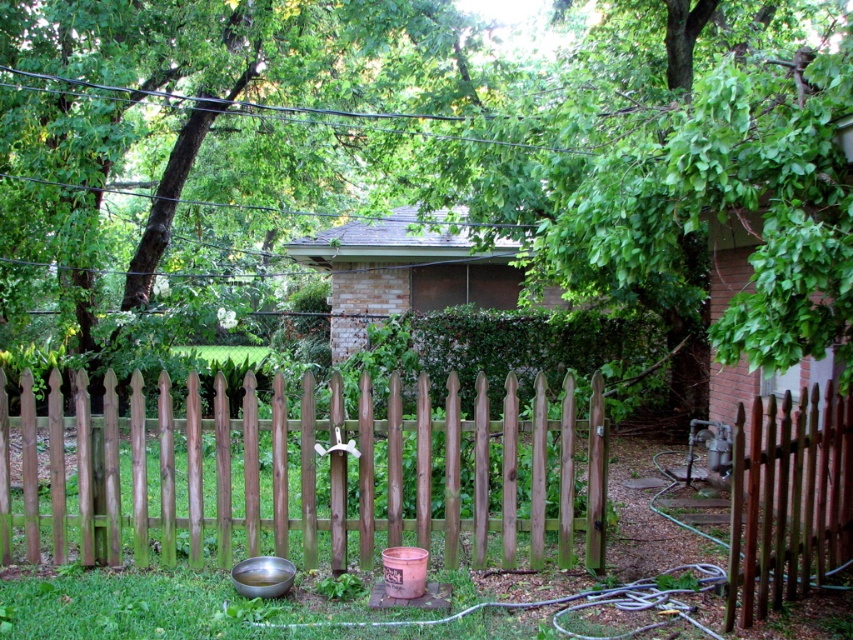
Is brown wooden fence at center above brown wooden fence at right?

No, brown wooden fence at center is not above brown wooden fence at right.

Is brown wooden fence at center smaller than brown wooden fence at right?

Actually, brown wooden fence at center might be larger than brown wooden fence at right.

Which is behind, point (434, 492) or point (755, 493)?

The point (434, 492) is behind.

This screenshot has width=853, height=640. I want to click on brown wooden fence at center, so click(x=299, y=472).

Find the location of a particular element. Image resolution: width=853 pixels, height=640 pixels. green leafy tree at upper center is located at coordinates (196, 147).

This screenshot has width=853, height=640. Identify the location of green leafy tree at upper center. coord(196,147).

Which is in front, point (355, 99) or point (776, 468)?

Positioned in front is point (776, 468).

How distant is green leafy tree at upper center from brown wooden fence at right?

7.94 meters

What do you see at coordinates (196, 147) in the screenshot? I see `green leafy tree at upper center` at bounding box center [196, 147].

Identify the location of green leafy tree at upper center. The width and height of the screenshot is (853, 640). (196, 147).